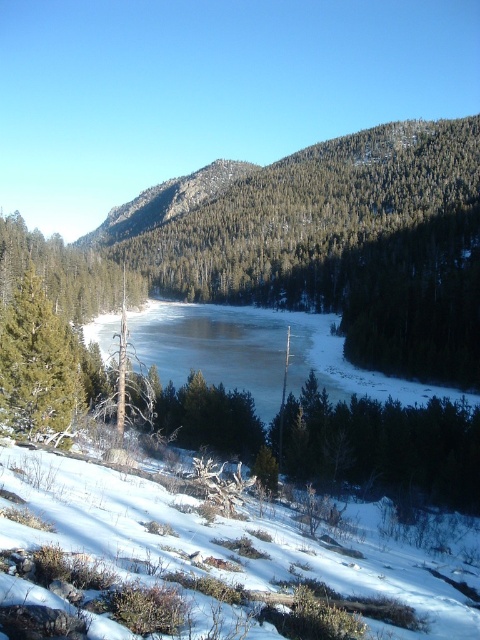
Question: Does white fluffy snow at lower left lie behind green textured forest at center?

Choices:
 (A) no
 (B) yes

Answer: (A)

Question: Which point is farther from the camera taking this photo?

Choices:
 (A) (19, 317)
 (B) (144, 209)
 (C) (435, 212)

Answer: (B)

Question: Which point is farther to the camera?

Choices:
 (A) (39, 400)
 (B) (417, 195)
 (C) (131, 224)

Answer: (C)

Question: Can you confirm if white fluffy snow at lower left is wider than green textured forest at center?

Choices:
 (A) yes
 (B) no

Answer: (B)

Question: Is brown wood tree at center smaller than green textured forest at center?

Choices:
 (A) no
 (B) yes

Answer: (B)

Question: Estimate the real-world distances between objects in this image. Which object is farther from the green textured forest at center?

Choices:
 (A) green matte tree at left
 (B) brown wood tree at center
 (C) white fluffy snow at lower left

Answer: (C)